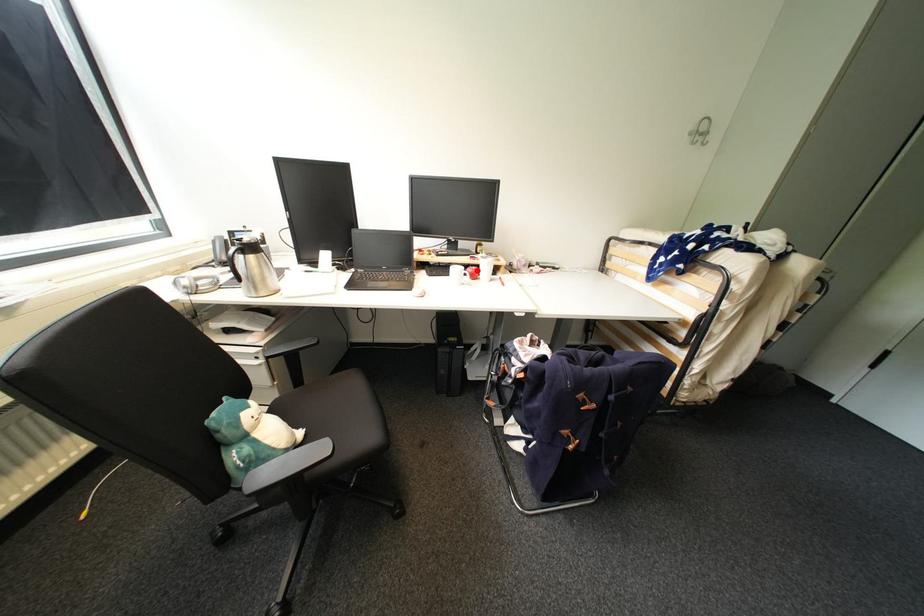
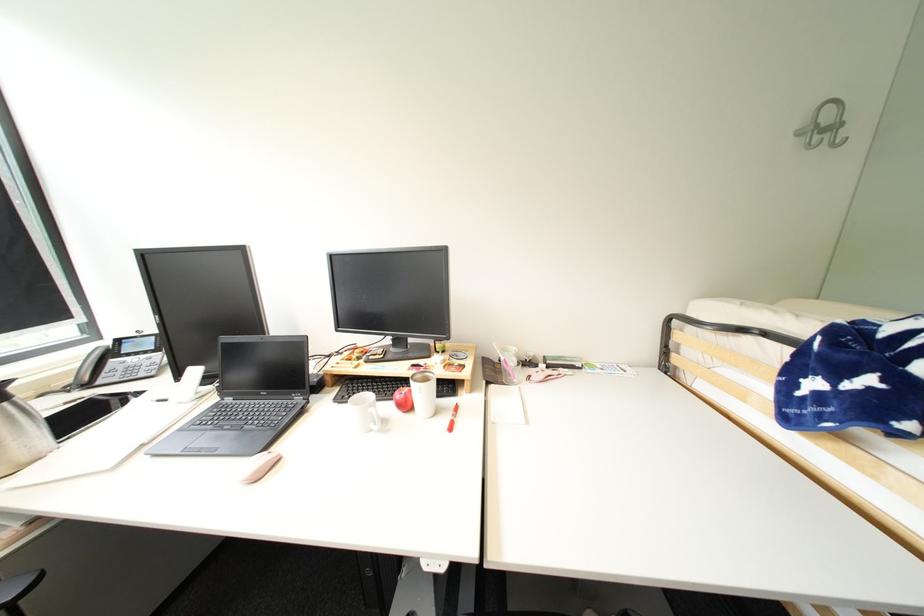
The point at the highlighted location is marked in the first image. Where is the corresponding point in the second image?

(405, 397)